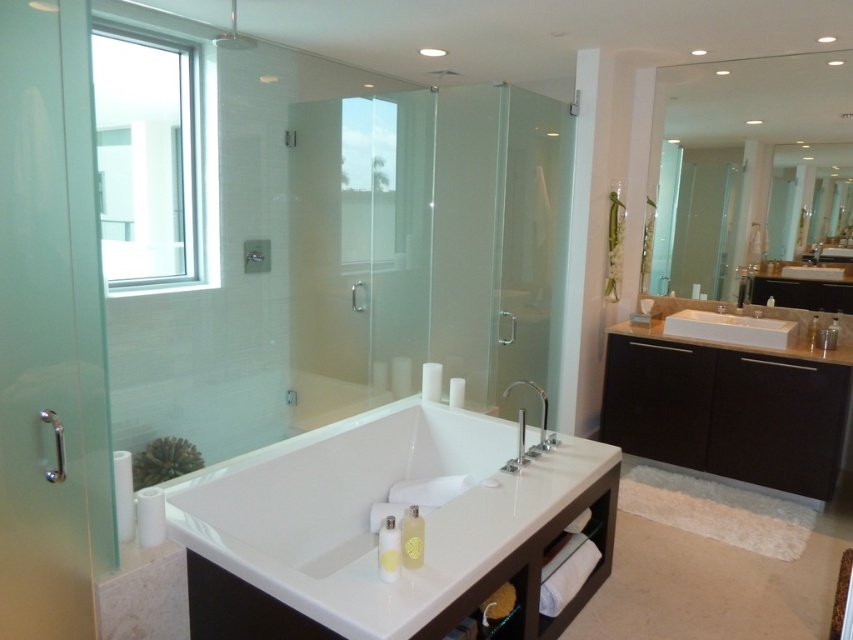
Does polished chrome faucet at center have a greater height compared to satin nickel faucet at right?

Yes, polished chrome faucet at center is taller than satin nickel faucet at right.

Does point (546, 404) come behind point (746, 292)?

Yes, it is.

This screenshot has width=853, height=640. Identify the location of polished chrome faucet at center. (541, 408).

Which is below, clear glass mirror at upper right or dark brown wood vanity at right?

dark brown wood vanity at right is below.

Looking at this image, is clear glass mirror at upper right positioned before dark brown wood vanity at right?

No, clear glass mirror at upper right is further to the viewer.

Does point (773, 177) come farther from viewer compared to point (688, 340)?

Yes, point (773, 177) is behind point (688, 340).

Find the location of a particular element. The image size is (853, 640). clear glass mirror at upper right is located at coordinates tap(750, 163).

Can you confirm if clear glass mirror at upper right is positioned to the right of satin nickel faucet at right?

Incorrect, clear glass mirror at upper right is not on the right side of satin nickel faucet at right.

Measure the distance from clear glass mirror at upper right to satin nickel faucet at right.

clear glass mirror at upper right is 22.90 inches from satin nickel faucet at right.

I want to click on clear glass mirror at upper right, so click(x=750, y=163).